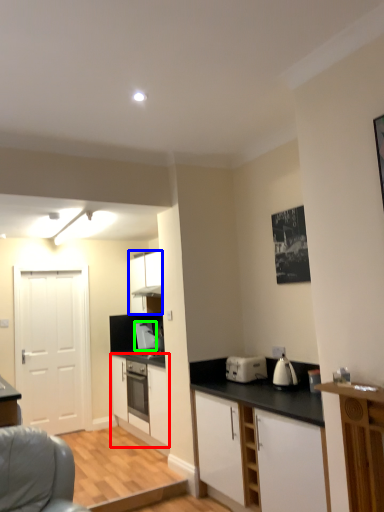
Question: Considering the real-world distances, which object is farthest from cabinetry (highlighted by a red box)? cabinetry (highlighted by a blue box) or kitchen appliance (highlighted by a green box)?

Choices:
 (A) cabinetry
 (B) kitchen appliance

Answer: (A)